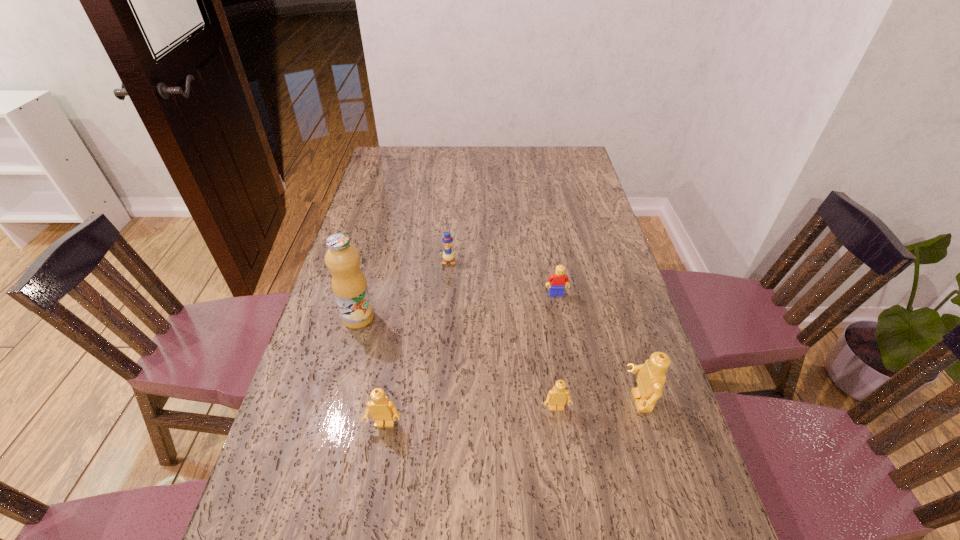
Identify the location of free region at the right edge of the desktop. (572, 247).

Locate an element on the screen. free space between the fourth object from right to left and the second tallest object is located at coordinates (543, 331).

The image size is (960, 540). What are the coordinates of `vacant point located between the third object from left to right and the second tallest object` in the screenshot? It's located at (543, 331).

The image size is (960, 540). Find the location of `vacant area that lies between the leftmost object and the farthest Lego`. vacant area that lies between the leftmost object and the farthest Lego is located at coordinates (457, 306).

This screenshot has width=960, height=540. What are the coordinates of `vacant space that is in between the farthest object and the farthest Lego` in the screenshot? It's located at (502, 278).

Identify the location of unoccupied area between the duckling and the second object from left to right. This screenshot has width=960, height=540. click(417, 343).

This screenshot has height=540, width=960. Identify the location of free space between the fourth nearest object and the farthest Lego. (457, 306).

The height and width of the screenshot is (540, 960). In order to click on free space between the farthest object and the tallest Lego in this screenshot , I will do `click(543, 331)`.

Identify the location of vacant region between the second farthest object and the fifth object from right to left. (470, 359).

The width and height of the screenshot is (960, 540). Find the location of `free space between the fourth nearest object and the farthest object`. free space between the fourth nearest object and the farthest object is located at coordinates (403, 289).